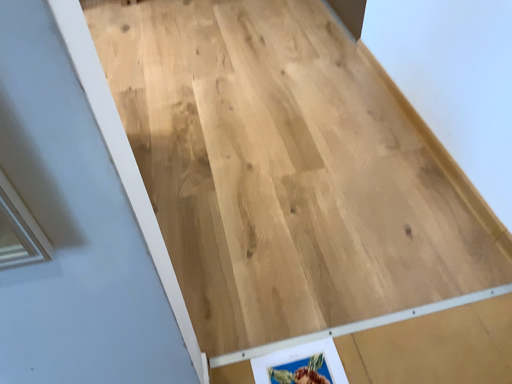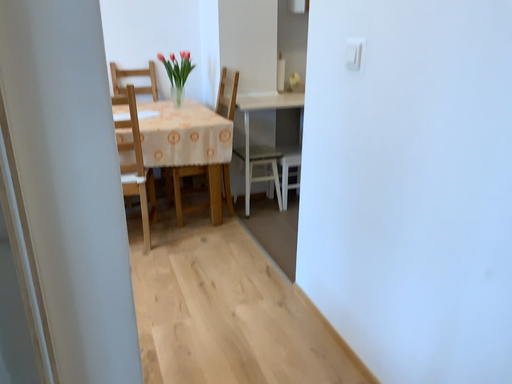
Question: Which way did the camera rotate in the video?

Choices:
 (A) rotated left
 (B) rotated right

Answer: (B)